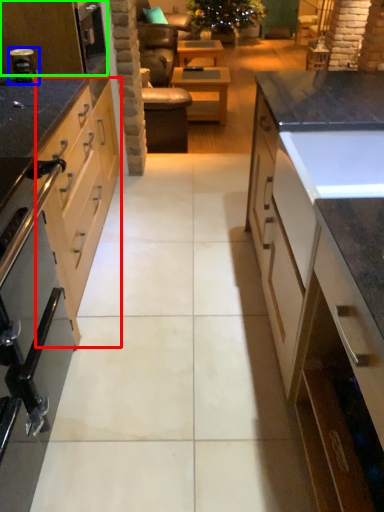
Question: Which object is positioned closest to cabinetry (highlighted by a red box)? Select from appliance (highlighted by a blue box) and kitchen appliance (highlighted by a green box).

Choices:
 (A) appliance
 (B) kitchen appliance

Answer: (B)